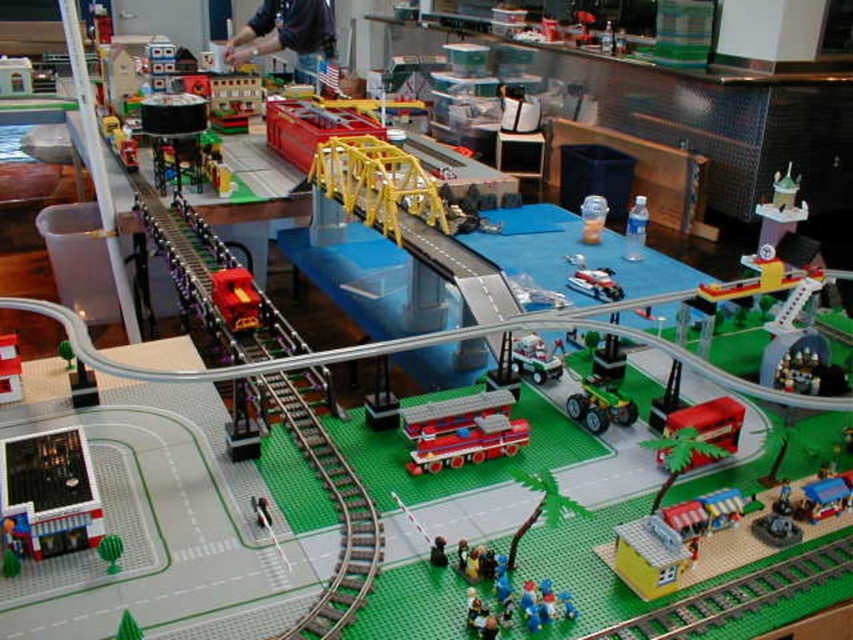
Can you confirm if dark blue shirt at upper center is thinner than green matte cactus at lower left?

No, dark blue shirt at upper center is not thinner than green matte cactus at lower left.

From the picture: Can you confirm if dark blue shirt at upper center is positioned to the left of green matte cactus at lower left?

Indeed, dark blue shirt at upper center is positioned on the left side of green matte cactus at lower left.

Is point (283, 0) positioned after point (100, 548)?

Yes, it is behind point (100, 548).

Locate an element on the screen. The image size is (853, 640). dark blue shirt at upper center is located at coordinates (286, 33).

Can you confirm if metallic red bus at lower right is taller than blue plastic train at lower right?

Correct, metallic red bus at lower right is much taller as blue plastic train at lower right.

Can you confirm if metallic red bus at lower right is positioned to the left of blue plastic train at lower right?

Correct, you'll find metallic red bus at lower right to the left of blue plastic train at lower right.

Who is more forward, (x=711, y=435) or (x=828, y=497)?

Point (x=828, y=497)

Where is `metallic red bus at lower right`? The height and width of the screenshot is (640, 853). metallic red bus at lower right is located at coordinates (711, 420).

Is green matte tractor at center-right thinner than green matte cactus at lower left?

No.

Who is more forward, [602,416] or [119,564]?

Point [119,564] is more forward.

Where is `green matte tractor at center-right`? This screenshot has height=640, width=853. green matte tractor at center-right is located at coordinates (601, 406).